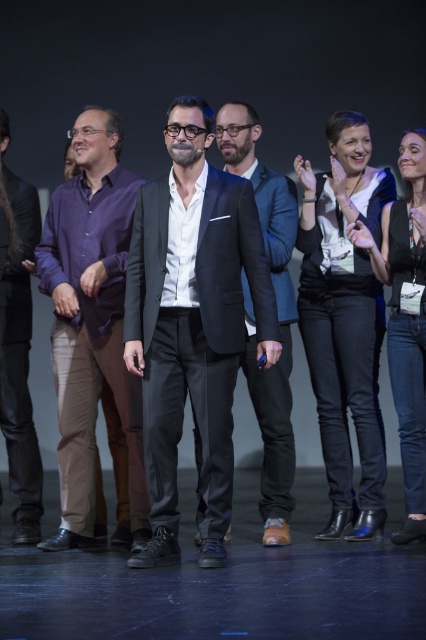
This screenshot has width=426, height=640. What do you see at coordinates (192, 324) in the screenshot?
I see `matte black suit at center` at bounding box center [192, 324].

Is matte black suit at center smaller than white fabric plaster bandage at center-right?

Actually, matte black suit at center might be larger than white fabric plaster bandage at center-right.

What do you see at coordinates (192, 324) in the screenshot?
I see `matte black suit at center` at bounding box center [192, 324].

Image resolution: width=426 pixels, height=640 pixels. Find the location of `matte black suit at center`. matte black suit at center is located at coordinates (192, 324).

Who is taller, black leather jacket at right or purple fabric shirt at left?

purple fabric shirt at left

Does black leather jacket at right have a larger size compared to purple fabric shirt at left?

→ Yes.

Locate an element on the screen. Image resolution: width=426 pixels, height=640 pixels. black leather jacket at right is located at coordinates (405, 320).

Image resolution: width=426 pixels, height=640 pixels. I want to click on black leather jacket at right, so click(405, 320).

Can you confirm if matte black suit at center is smaller than dark blue suit at center?

Correct, matte black suit at center occupies less space than dark blue suit at center.

Measure the distance between matte black suit at center and dark blue suit at center.

45.12 centimeters

The width and height of the screenshot is (426, 640). I want to click on matte black suit at center, so click(192, 324).

Identify the location of matte black suit at center. The image size is (426, 640). (192, 324).